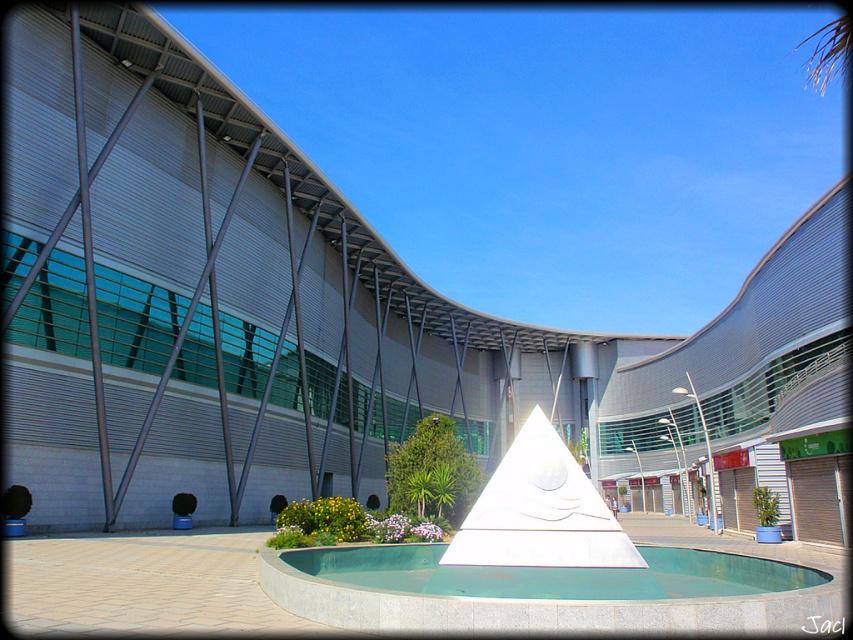
Is white marble fountain at center behind green polished stone pool at center?

That is False.

Which of these two, white marble fountain at center or green polished stone pool at center, stands taller?

Standing taller between the two is white marble fountain at center.

Is point (299, 604) farther from camera compared to point (762, 564)?

That is False.

Locate an element on the screen. This screenshot has height=640, width=853. white marble fountain at center is located at coordinates (547, 568).